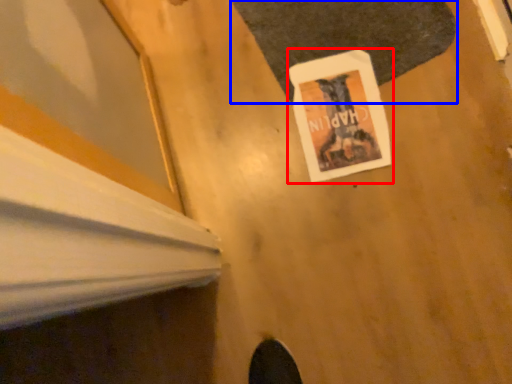
Question: Which object appears farthest to the camera in this image, poster page (highlighted by a red box) or mat (highlighted by a blue box)?

Choices:
 (A) poster page
 (B) mat

Answer: (A)